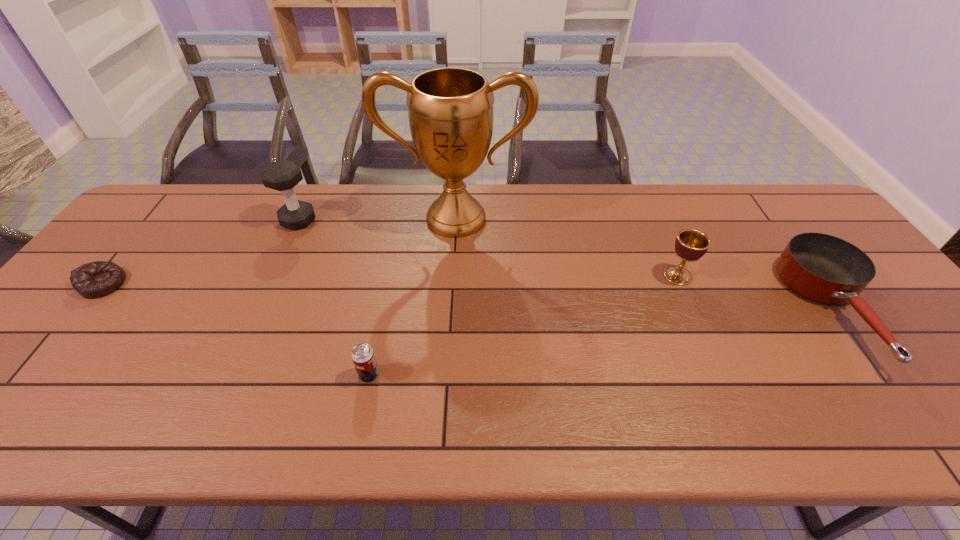
Where is `blank space located 0.200m on the right of the second object from left to right`? The image size is (960, 540). blank space located 0.200m on the right of the second object from left to right is located at coordinates (381, 220).

The height and width of the screenshot is (540, 960). Find the location of `vacant space located on the right of the second object from right to left`. vacant space located on the right of the second object from right to left is located at coordinates (756, 275).

Image resolution: width=960 pixels, height=540 pixels. Find the location of `vacant space located on the back of the beer can`. vacant space located on the back of the beer can is located at coordinates (384, 299).

Where is `vacant region located 0.090m on the handle side of the rightmost object`? Image resolution: width=960 pixels, height=540 pixels. vacant region located 0.090m on the handle side of the rightmost object is located at coordinates (915, 418).

The height and width of the screenshot is (540, 960). Identify the location of free space located on the front of the leftmost object. (48, 352).

Locate an element on the screen. trophy cup positioned at the far edge is located at coordinates (450, 110).

This screenshot has width=960, height=540. I want to click on dumbbell that is at the far edge, so click(283, 175).

Locate an element on the screen. This screenshot has height=540, width=960. object present at the left edge is located at coordinates (93, 280).

I want to click on object that is at the right edge, so click(x=826, y=269).

Identify the location of free space at the far edge of the desktop. The image size is (960, 540). (264, 188).